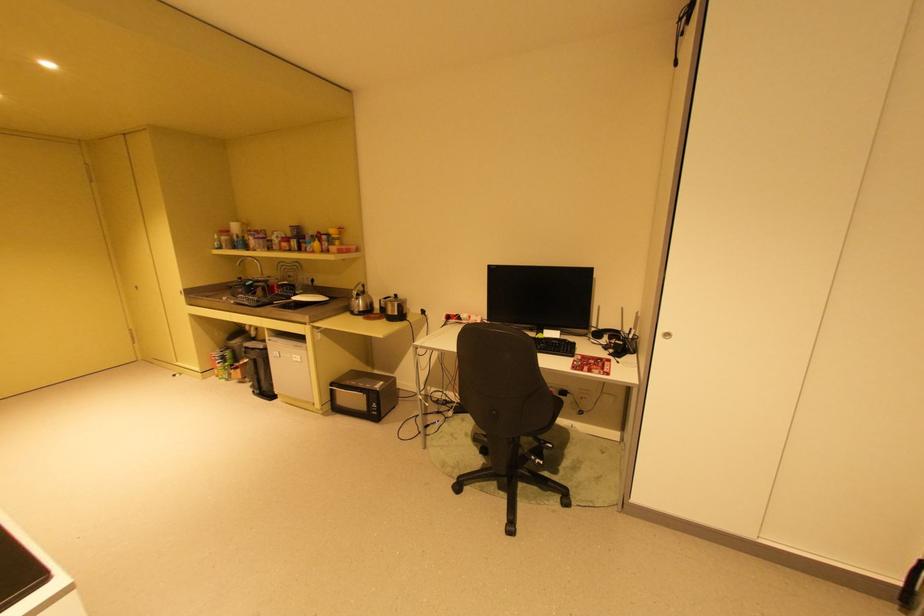
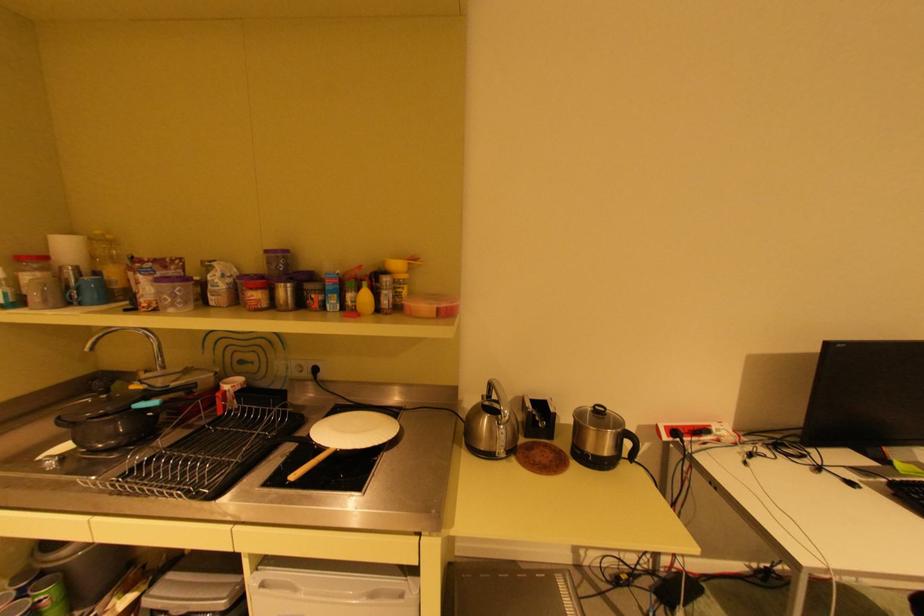
Locate, in the second image, the point that corresponds to point (298, 227) in the first image.

(274, 251)